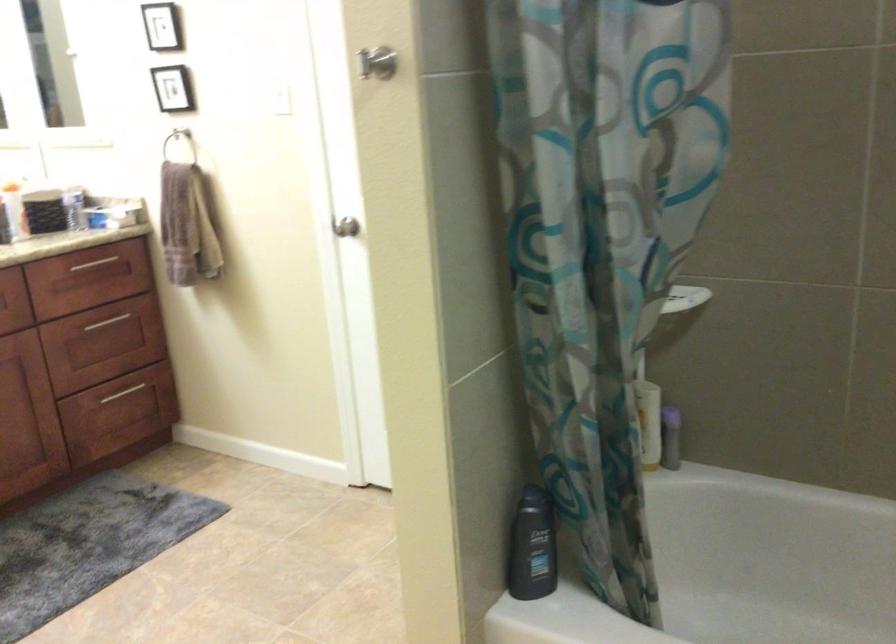
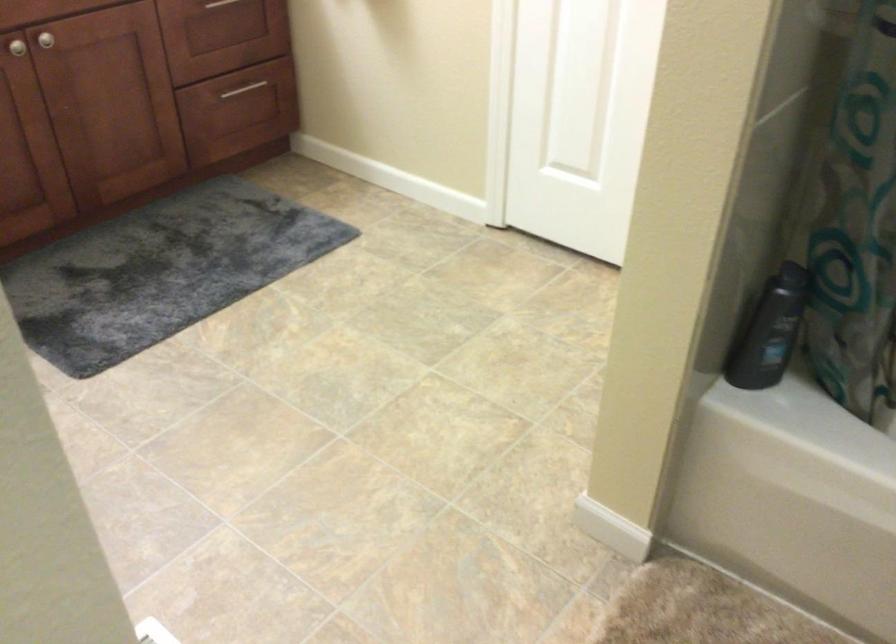
What movement of the cameraman would produce the second image?

The cameraman moved toward left, forward.